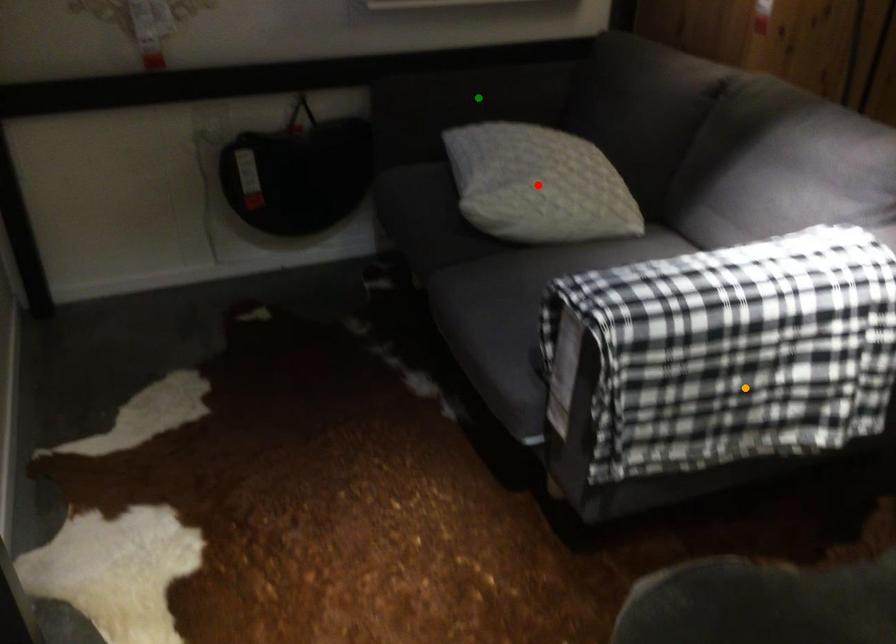
Order these from nearest to farthest:
1. red point
2. green point
3. orange point

orange point, red point, green point